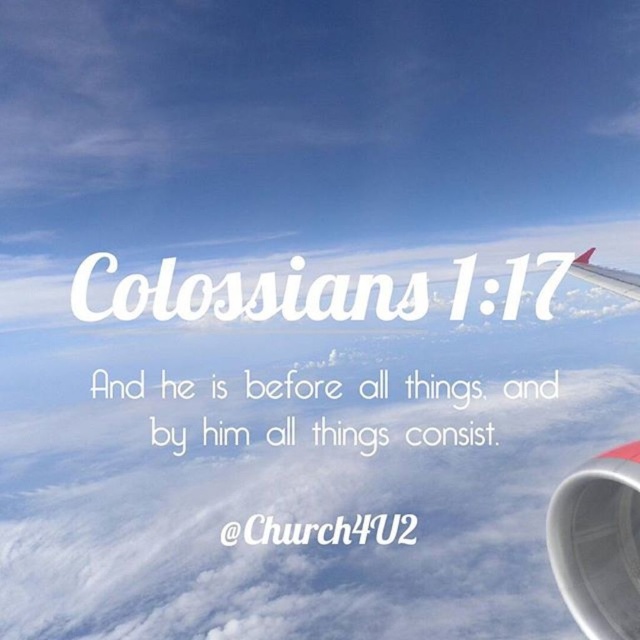
Question: Can you confirm if white metallic engine at right is positioned to the left of red matte wing at upper right?

Choices:
 (A) no
 (B) yes

Answer: (B)

Question: Which point is farther to the camera?

Choices:
 (A) click(621, 282)
 (B) click(609, 593)

Answer: (A)

Question: Which point is farther to the camera?

Choices:
 (A) red matte wing at upper right
 (B) white metallic engine at right

Answer: (A)

Question: Does white metallic engine at right come behind red matte wing at upper right?

Choices:
 (A) yes
 (B) no

Answer: (B)

Question: Which of the following is the farthest from the observer?

Choices:
 (A) white metallic engine at right
 (B) red matte wing at upper right

Answer: (B)

Question: Is white metallic engine at right wider than red matte wing at upper right?

Choices:
 (A) yes
 (B) no

Answer: (B)